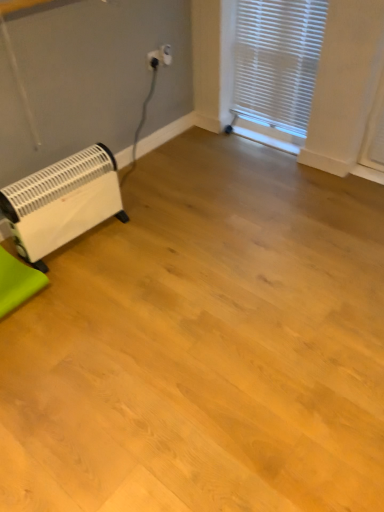
The width and height of the screenshot is (384, 512). Identify the location of vacant area that is situated to the right of white plastic heater at lower left. (156, 238).